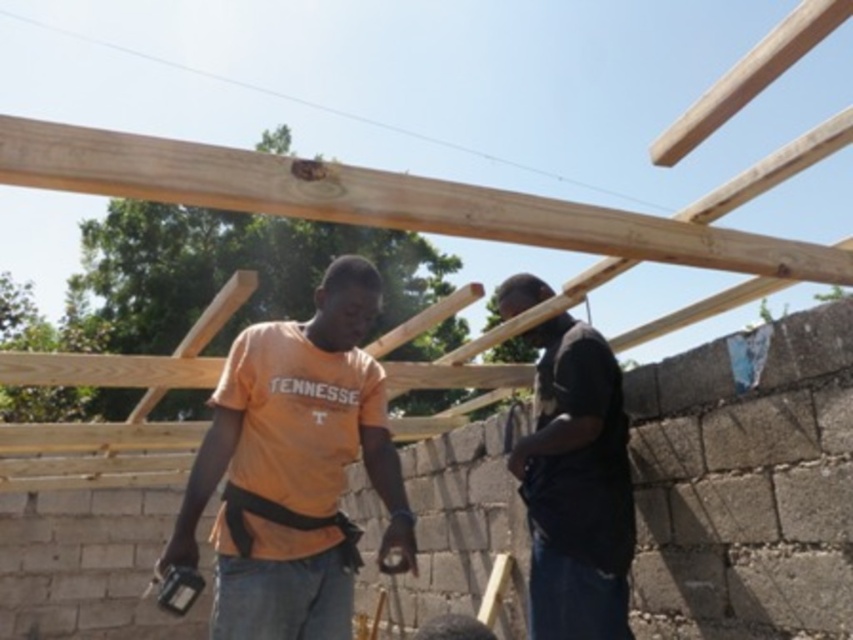
Question: Does orange cotton shirt at center have a smaller size compared to black matte shirt at center?

Choices:
 (A) no
 (B) yes

Answer: (B)

Question: Which point is farther from the camera taking this photo?

Choices:
 (A) (538, 593)
 (B) (355, 170)

Answer: (A)

Question: Is orange cotton shirt at center above black matte shirt at center?

Choices:
 (A) yes
 (B) no

Answer: (A)

Question: Considering the relative positions of natural wood beam at upper center and black matte shirt at center in the image provided, where is natural wood beam at upper center located with respect to black matte shirt at center?

Choices:
 (A) left
 (B) right

Answer: (A)

Question: Which point is farther to the camera?

Choices:
 (A) (225, 532)
 (B) (550, 230)
 (C) (567, 461)

Answer: (C)

Question: Which object is the closest to the orange cotton shirt at center?

Choices:
 (A) black matte shirt at center
 (B) natural wood beam at upper center

Answer: (B)